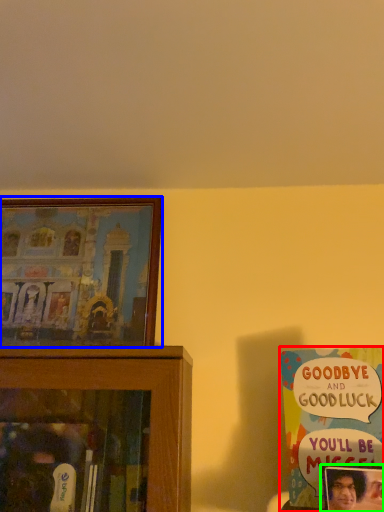
Question: Which is nearer to the book (highlighted by a red box)? picture frame (highlighted by a blue box) or picture frame (highlighted by a green box).

Choices:
 (A) picture frame
 (B) picture frame

Answer: (B)